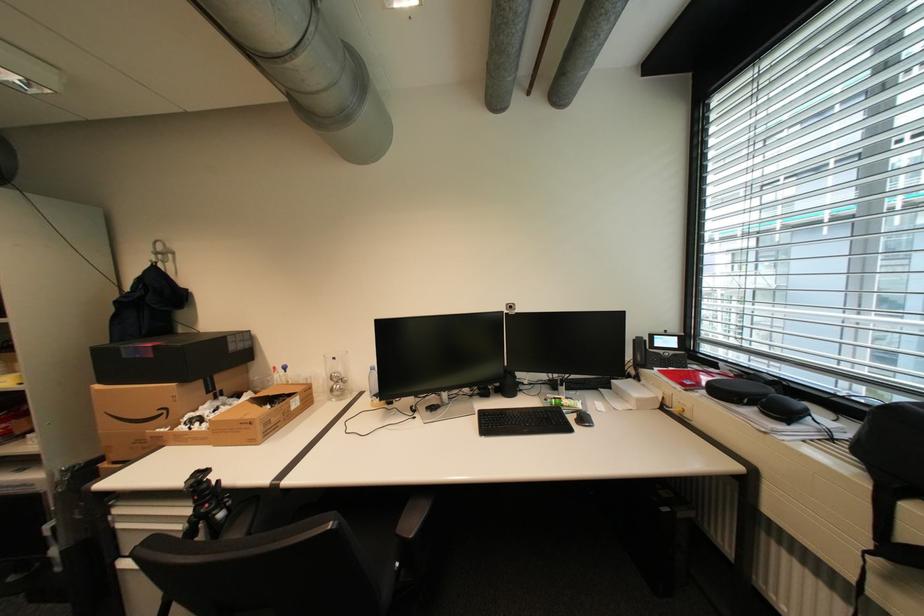
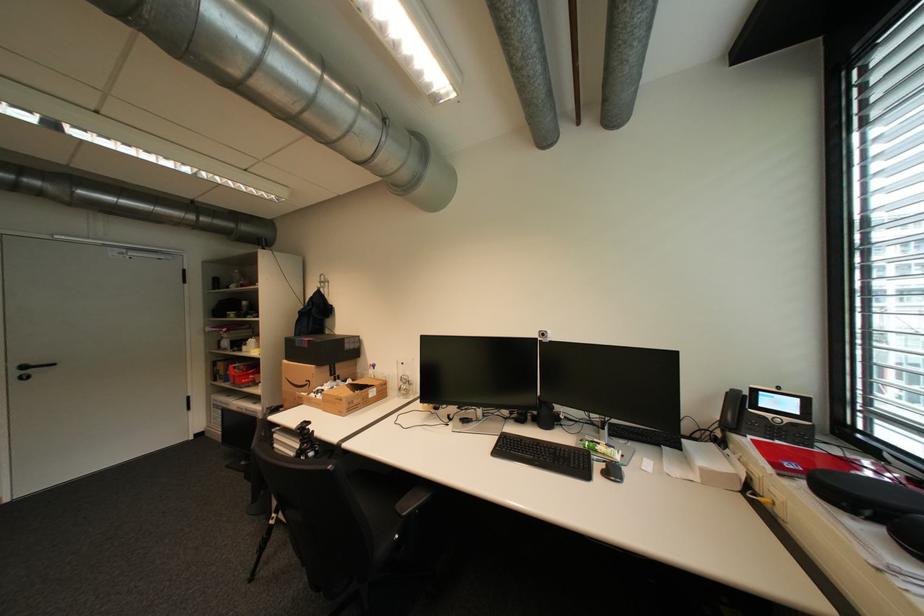
Find the pixel in the second image that matches pixel 337 527 in the first image.

(337, 468)